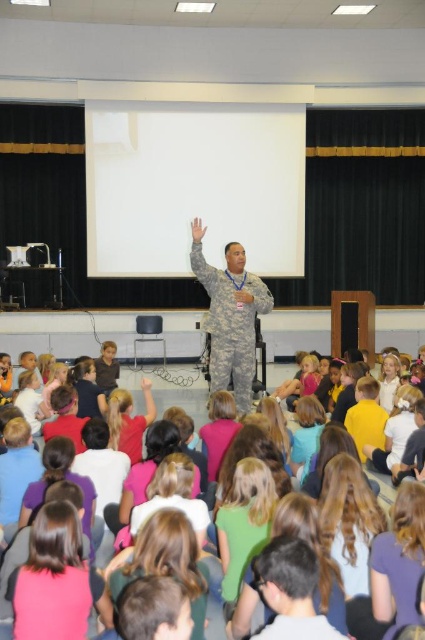
Question: Can you confirm if pink fabric hair at lower left is positioned below camouflage uniform at center?

Choices:
 (A) yes
 (B) no

Answer: (A)

Question: Does pink fabric hair at lower left lie behind camouflage uniform at center?

Choices:
 (A) no
 (B) yes

Answer: (A)

Question: Among these points, which one is farthest from the camera?

Choices:
 (A) (40, 605)
 (B) (246, 310)

Answer: (B)

Question: Can you confirm if pink fabric hair at lower left is wider than camouflage uniform at center?

Choices:
 (A) no
 (B) yes

Answer: (A)

Question: Which object is farther from the camera taking this photo?

Choices:
 (A) pink fabric hair at lower left
 (B) camouflage uniform at center

Answer: (B)